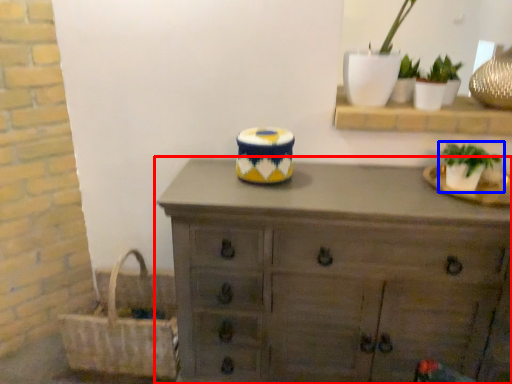
Question: Among these objects, which one is farthest to the camera, chest of drawers (highlighted by a red box) or houseplant (highlighted by a blue box)?

Choices:
 (A) chest of drawers
 (B) houseplant

Answer: (B)